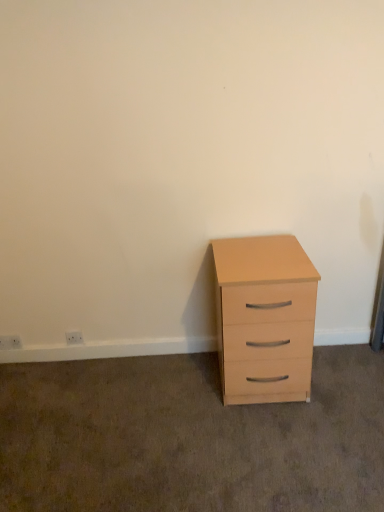
Question: Does white plastic electric outlet at lower left, marked as the 1th electric outlet in a left-to-right arrangement, have a lesser height compared to white plastic electric outlet at lower left, which is the 2th electric outlet from left to right?

Choices:
 (A) yes
 (B) no

Answer: (B)

Question: Is white plastic electric outlet at lower left, positioned as the second electric outlet in right-to-left order, outside white plastic electric outlet at lower left, which is the 2th electric outlet from left to right?

Choices:
 (A) no
 (B) yes

Answer: (B)

Question: Is white plastic electric outlet at lower left, marked as the 1th electric outlet in a left-to-right arrangement, further to camera compared to white plastic electric outlet at lower left, which is the 2th electric outlet from left to right?

Choices:
 (A) yes
 (B) no

Answer: (A)

Question: From a real-world perspective, is white plastic electric outlet at lower left, positioned as the second electric outlet in right-to-left order, physically above white plastic electric outlet at lower left, the 1th electric outlet viewed from the right?

Choices:
 (A) no
 (B) yes

Answer: (A)

Question: Is the depth of white plastic electric outlet at lower left, positioned as the second electric outlet in right-to-left order, less than that of white plastic electric outlet at lower left, which is the 2th electric outlet from left to right?

Choices:
 (A) yes
 (B) no

Answer: (B)

Question: Is white plastic electric outlet at lower left, marked as the 1th electric outlet in a left-to-right arrangement, next to white plastic electric outlet at lower left, which is the 2th electric outlet from left to right, and touching it?

Choices:
 (A) yes
 (B) no

Answer: (B)

Question: Is white plastic electric outlet at lower left, which is the 2th electric outlet from left to right, positioned far away from light wood chest of drawers at right?

Choices:
 (A) yes
 (B) no

Answer: (A)

Question: Considering the relative positions of white plastic electric outlet at lower left, which is the 2th electric outlet from left to right, and light wood chest of drawers at right in the image provided, is white plastic electric outlet at lower left, which is the 2th electric outlet from left to right, to the right of light wood chest of drawers at right from the viewer's perspective?

Choices:
 (A) no
 (B) yes

Answer: (A)

Question: Is white plastic electric outlet at lower left, which is the 2th electric outlet from left to right, in contact with light wood chest of drawers at right?

Choices:
 (A) yes
 (B) no

Answer: (B)

Question: Can you confirm if white plastic electric outlet at lower left, which is the 2th electric outlet from left to right, is shorter than light wood chest of drawers at right?

Choices:
 (A) yes
 (B) no

Answer: (A)

Question: From the image's perspective, is white plastic electric outlet at lower left, which is the 2th electric outlet from left to right, on light wood chest of drawers at right?

Choices:
 (A) no
 (B) yes

Answer: (A)

Question: Is white plastic electric outlet at lower left, which is the 2th electric outlet from left to right, aimed at light wood chest of drawers at right?

Choices:
 (A) no
 (B) yes

Answer: (A)

Question: Are white plastic electric outlet at lower left, the 1th electric outlet viewed from the right, and white plastic electric outlet at lower left, marked as the 1th electric outlet in a left-to-right arrangement, far apart?

Choices:
 (A) yes
 (B) no

Answer: (B)